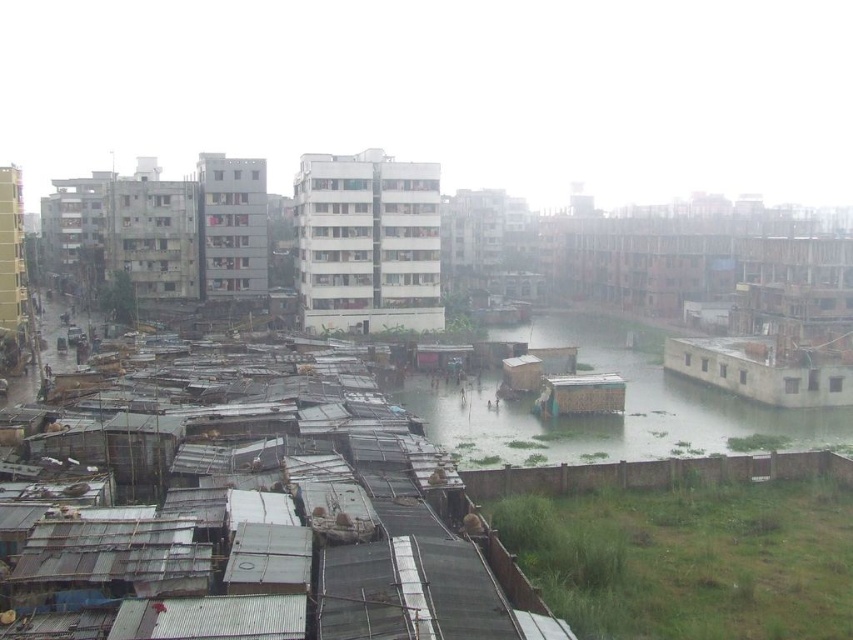
Question: Which point is farther to the camera?

Choices:
 (A) white matte building at center
 (B) gray concrete building at center

Answer: (B)

Question: Does green grassy river at center appear under gray concrete building at center?

Choices:
 (A) yes
 (B) no

Answer: (A)

Question: Which of the following is the farthest from the observer?

Choices:
 (A) (842, 404)
 (B) (244, 212)
 (C) (619, 444)

Answer: (B)

Question: Can you confirm if green grassy river at center is smaller than concrete wall at right?

Choices:
 (A) no
 (B) yes

Answer: (A)

Question: Is white matte building at center closer to the viewer compared to concrete wall at right?

Choices:
 (A) no
 (B) yes

Answer: (A)

Question: Estimate the real-world distances between objects in this image. Which object is farther from the gray concrete building at center?

Choices:
 (A) green grassy river at center
 (B) concrete wall at right

Answer: (B)